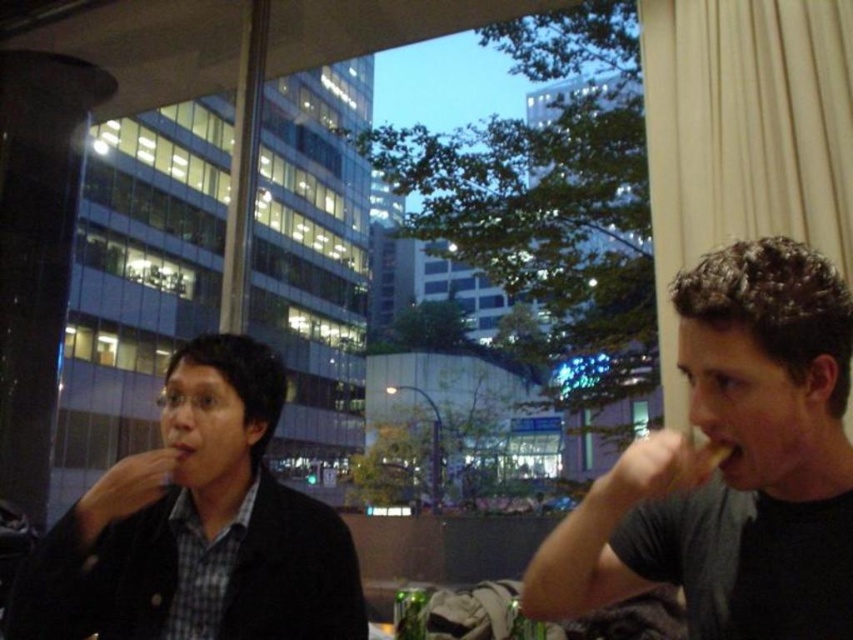
Question: Among these objects, which one is farthest from the camera?

Choices:
 (A) matte black jacket at left
 (B) black matte shirt at right

Answer: (A)

Question: Is black matte shirt at right in front of matte black jacket at left?

Choices:
 (A) no
 (B) yes

Answer: (B)

Question: Which of the following is the farthest from the observer?

Choices:
 (A) (618, 506)
 (B) (204, 616)

Answer: (B)

Question: Which point is farther to the camera?

Choices:
 (A) black matte shirt at right
 (B) matte black jacket at left

Answer: (B)

Question: Can you confirm if black matte shirt at right is smaller than matte black jacket at left?

Choices:
 (A) no
 (B) yes

Answer: (A)

Question: Is black matte shirt at right bigger than matte black jacket at left?

Choices:
 (A) no
 (B) yes

Answer: (B)